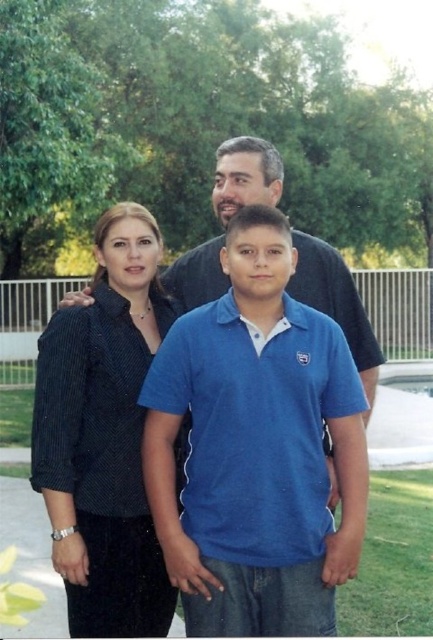
Question: Which of the following is the closest to the observer?

Choices:
 (A) (226, 396)
 (B) (151, 288)

Answer: (A)

Question: Does blue cotton shirt at center appear under dark blue striped shirt at left?

Choices:
 (A) yes
 (B) no

Answer: (B)

Question: Is blue cotton shirt at center in front of dark blue striped shirt at left?

Choices:
 (A) yes
 (B) no

Answer: (A)

Question: Can you confirm if blue cotton shirt at center is positioned to the left of dark blue striped shirt at left?

Choices:
 (A) no
 (B) yes

Answer: (A)

Question: Which point is closer to the camera taking this photo?

Choices:
 (A) (304, 524)
 (B) (76, 584)

Answer: (A)